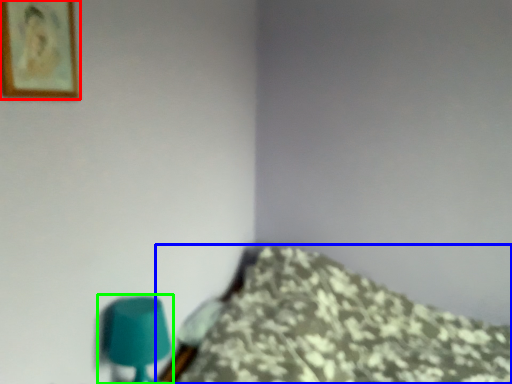
Question: Which object is the farthest from picture frame (highlighted by a red box)? Choose among these: furniture (highlighted by a blue box) or table lamp (highlighted by a green box).

Choices:
 (A) furniture
 (B) table lamp

Answer: (A)